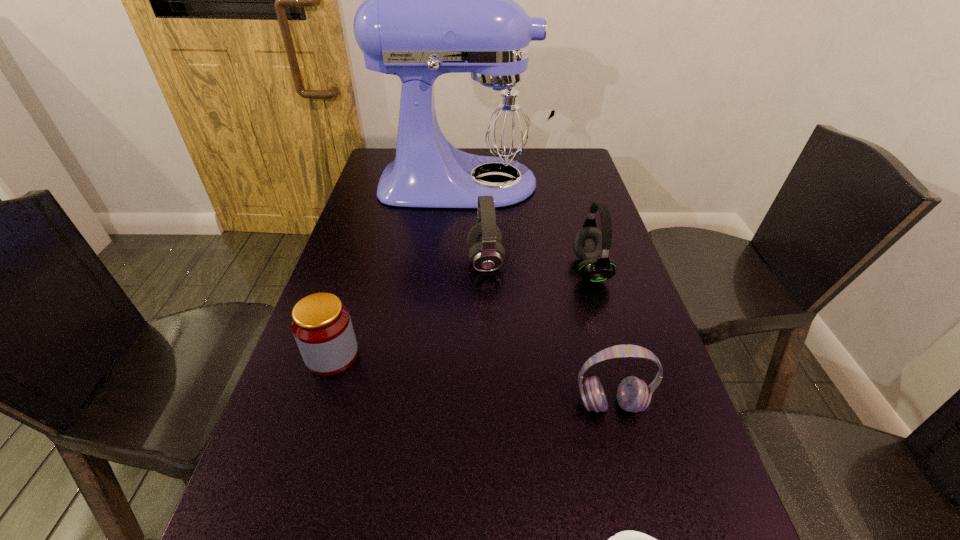
What are the coordinates of `the second closest headset to the mixer` in the screenshot? It's located at (591, 245).

Select which headset appears as the second closest to the farthest object. Please provide its 2D coordinates. Your answer should be formatted as a tuple, i.e. [(x, y)], where the tuple contains the x and y coordinates of a point satisfying the conditions above.

[(591, 245)]